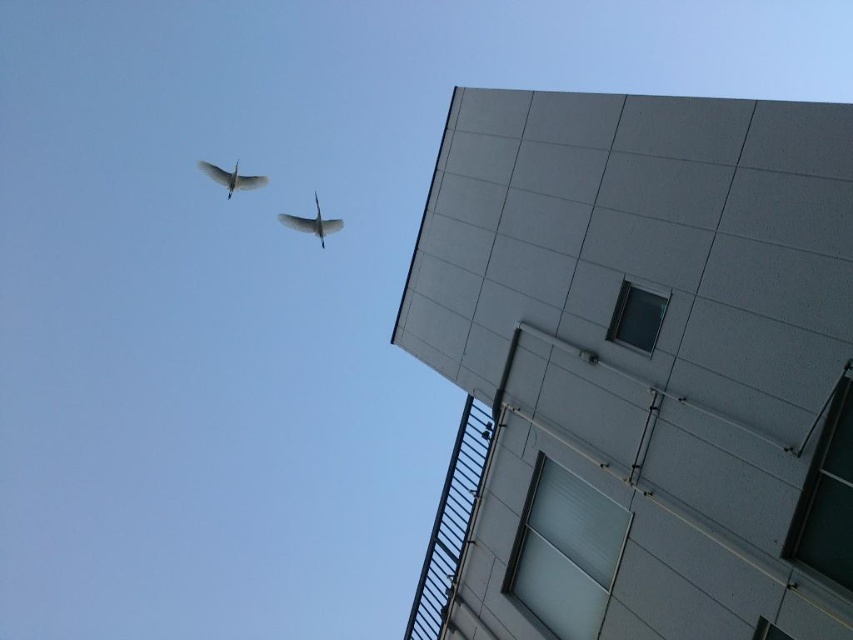
Question: In this image, where is white matte bird at upper left located relative to white glossy bird at upper center?

Choices:
 (A) right
 (B) left

Answer: (B)

Question: Which point appears closest to the camera in this image?

Choices:
 (A) (318, 220)
 (B) (206, 163)

Answer: (A)

Question: Can you confirm if white matte bird at upper left is wider than white glossy bird at upper center?

Choices:
 (A) yes
 (B) no

Answer: (A)

Question: Can you confirm if white matte bird at upper left is smaller than white glossy bird at upper center?

Choices:
 (A) yes
 (B) no

Answer: (A)

Question: Which point is closer to the camera?

Choices:
 (A) white glossy bird at upper center
 (B) white matte bird at upper left

Answer: (A)